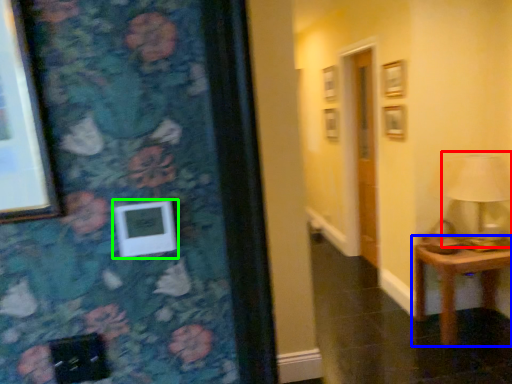
Question: Estimate the real-world distances between objects in this image. Which object is farther from table lamp (highlighted by a red box), table (highlighted by a blue box) or picture frame (highlighted by a green box)?

Choices:
 (A) table
 (B) picture frame

Answer: (B)